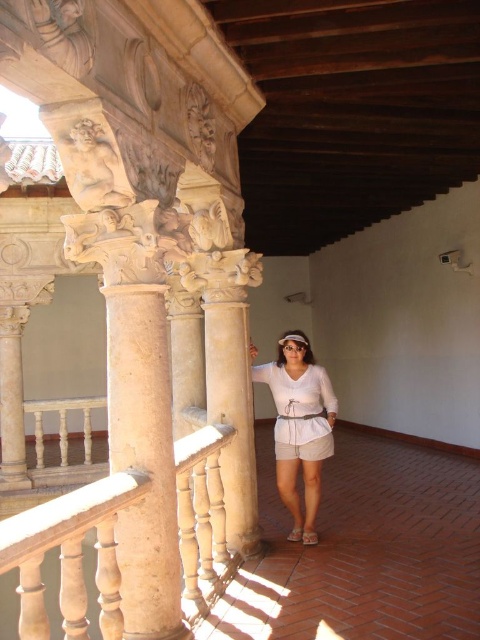
Does beige stone column at center have a smaller size compared to white fabric sandal at lower center?

Actually, beige stone column at center might be larger than white fabric sandal at lower center.

Does beige stone column at center have a larger size compared to white fabric sandal at lower center?

Yes.

This screenshot has width=480, height=640. Find the location of `beige stone column at center`. beige stone column at center is located at coordinates (144, 460).

From the picture: Can you confirm if white cotton shorts at center is positioned to the right of white cotton dress at center?

In fact, white cotton shorts at center is to the left of white cotton dress at center.

Is white cotton shorts at center shorter than white cotton dress at center?

No, white cotton shorts at center is not shorter than white cotton dress at center.

You are a GUI agent. You are given a task and a screenshot of the screen. Output one action in this format:
    pyautogui.click(x=<x>, y=<y>)
    Task: Click on the white cotton shorts at center
    This screenshot has height=640, width=480.
    Given the screenshot: What is the action you would take?
    pyautogui.click(x=300, y=420)

Image resolution: width=480 pixels, height=640 pixels. Find the location of `white cotton shorts at center`. white cotton shorts at center is located at coordinates (300, 420).

What do you see at coordinates (144, 460) in the screenshot? I see `beige stone column at center` at bounding box center [144, 460].

Locate an element on the screen. The width and height of the screenshot is (480, 640). beige stone column at center is located at coordinates (144, 460).